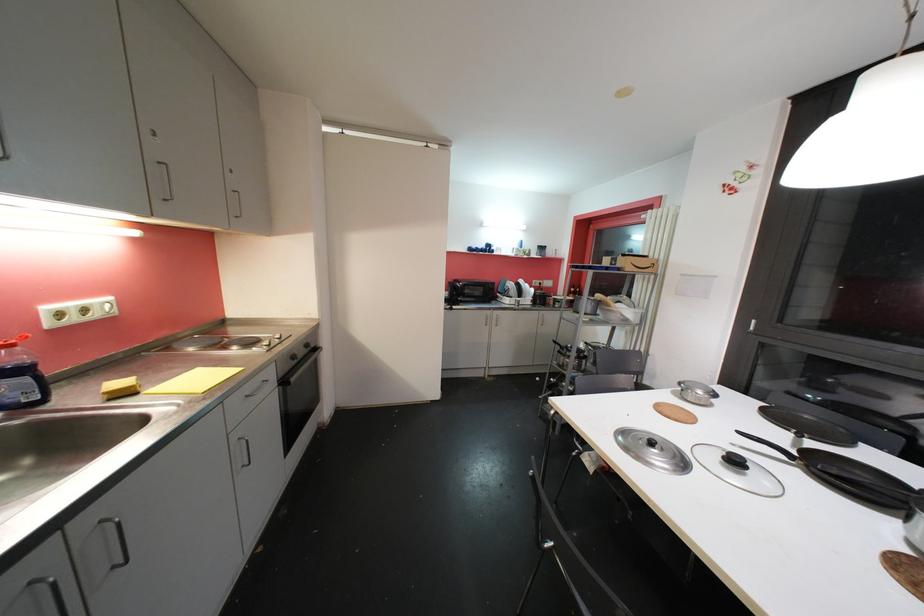
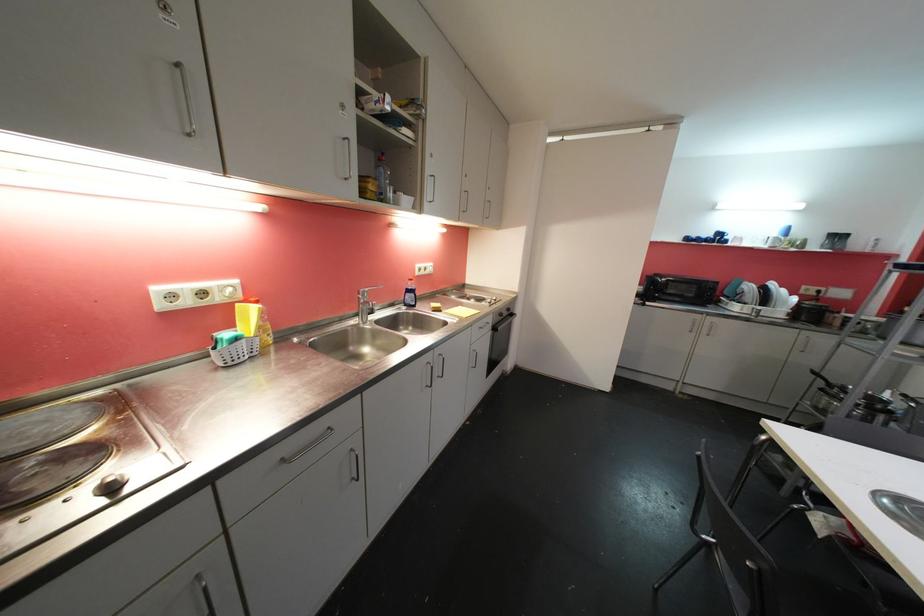
Where in the second image is the point corresponding to (298,360) from the first image?

(505, 317)